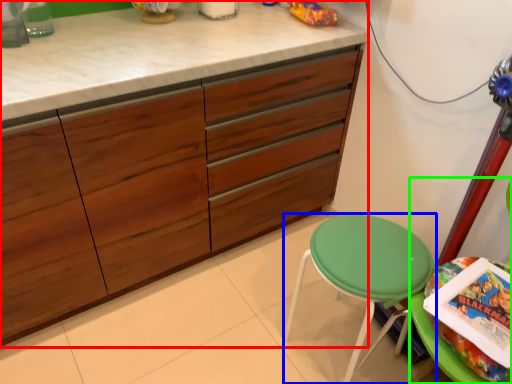
Question: Considering the real-world distances, which object is farthest from cabinetry (highlighted by a red box)? stool (highlighted by a blue box) or swivel chair (highlighted by a green box)?

Choices:
 (A) stool
 (B) swivel chair

Answer: (B)